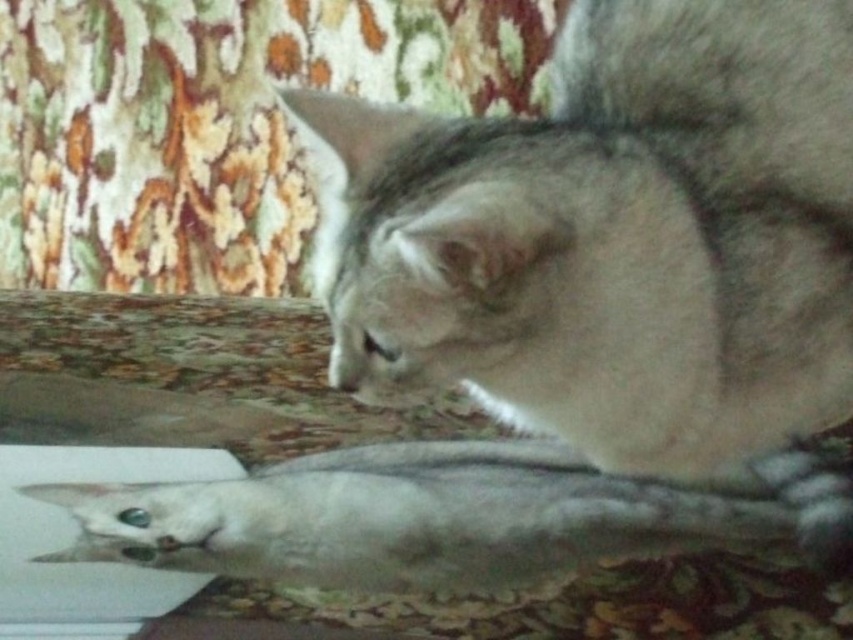
Question: Which object is farther from the camera taking this photo?

Choices:
 (A) white matte fish at lower center
 (B) fuzzy white cat at center

Answer: (A)

Question: Is fuzzy white cat at center positioned at the back of white matte fish at lower center?

Choices:
 (A) yes
 (B) no

Answer: (B)

Question: Can you confirm if fuzzy white cat at center is bigger than white matte fish at lower center?

Choices:
 (A) no
 (B) yes

Answer: (B)

Question: Which object is farther from the camera taking this photo?

Choices:
 (A) white matte fish at lower center
 (B) fuzzy white cat at center

Answer: (A)

Question: Is fuzzy white cat at center above white matte fish at lower center?

Choices:
 (A) no
 (B) yes

Answer: (B)